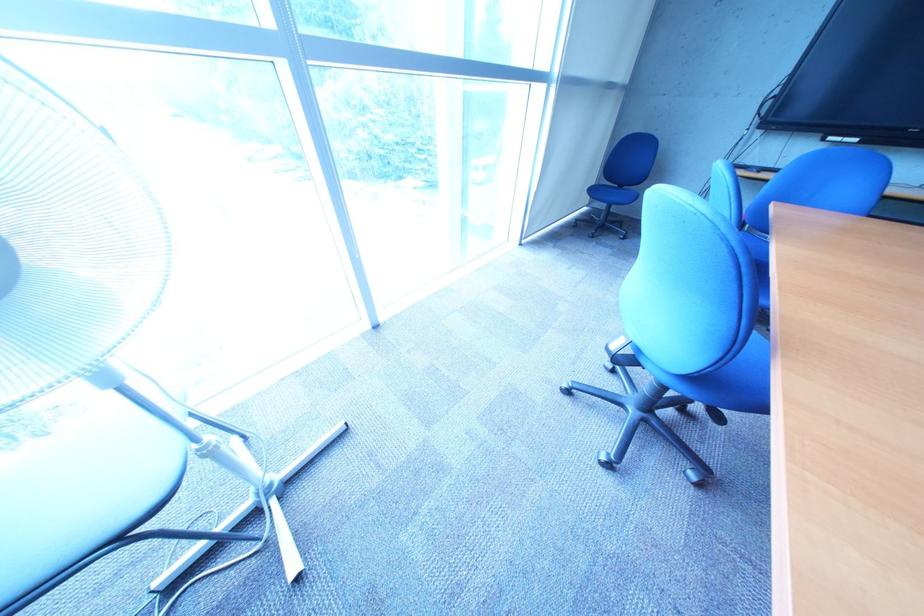
Find where to sit the light blue chair sitting surface. Please return your answer as a coordinate pair (x, y).

(748, 371)